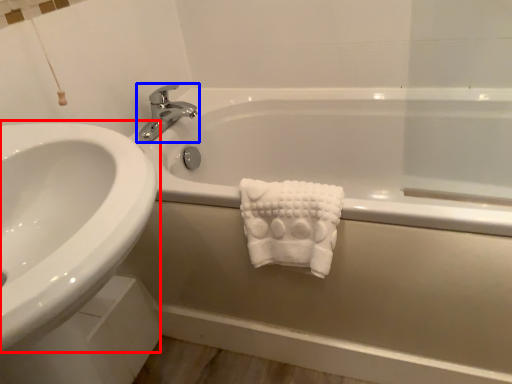
Question: Which object appears farthest to the camera in this image, sink (highlighted by a red box) or tap (highlighted by a blue box)?

Choices:
 (A) sink
 (B) tap

Answer: (B)